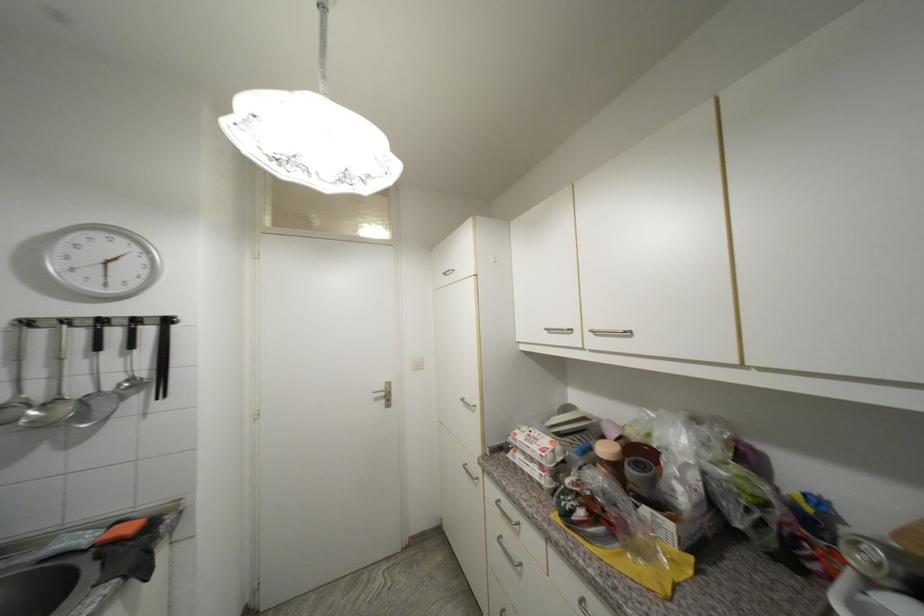
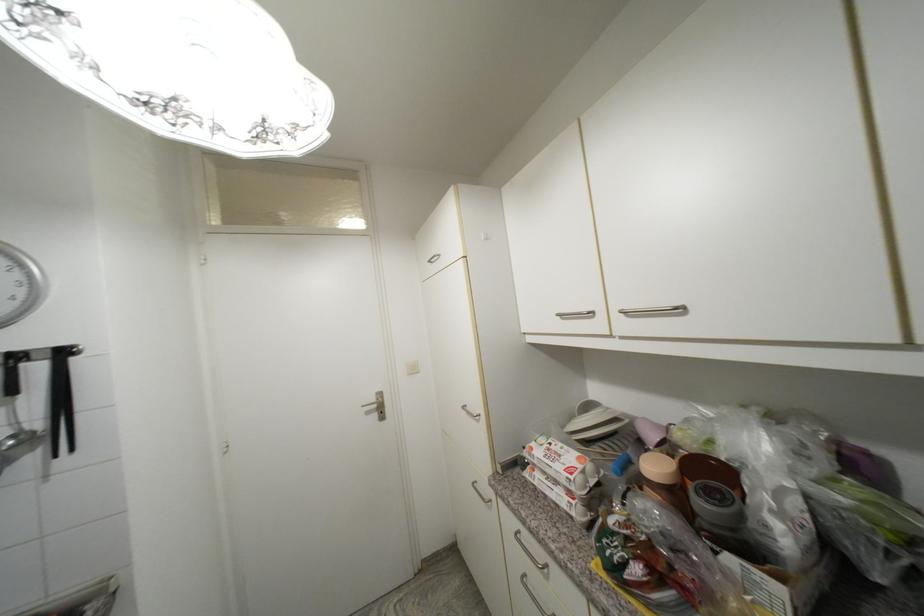
Locate, in the second image, the point that corresponds to point 612,451 in the first image.

(662, 469)